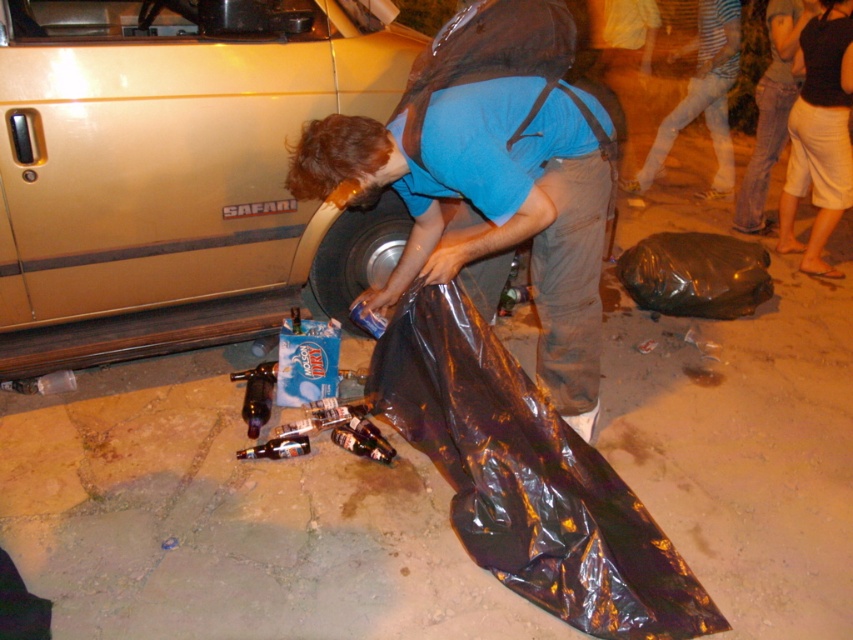
Question: Does shiny plastic bag at center appear on the right side of white cotton shorts at lower right?

Choices:
 (A) yes
 (B) no

Answer: (B)

Question: Estimate the real-world distances between objects in this image. Which object is farther from the striped cotton shirt at lower right?

Choices:
 (A) metallic silver tire at lower center
 (B) shiny plastic bag at center
 (C) white cotton shorts at lower right
 (D) gold metallic car door at lower left

Answer: (B)

Question: Considering the real-world distances, which object is farthest from the black plastic bag at lower right?

Choices:
 (A) gold metallic car door at lower left
 (B) white cotton shorts at lower right

Answer: (A)

Question: Among these points, which one is farthest from the camera?

Choices:
 (A) (392, 289)
 (B) (399, 228)
 (C) (717, 125)

Answer: (C)

Question: Does gold metallic car door at lower left have a lesser width compared to striped cotton shirt at lower right?

Choices:
 (A) no
 (B) yes

Answer: (A)

Question: Is the position of black plastic bag at lower right more distant than that of metallic silver tire at lower center?

Choices:
 (A) no
 (B) yes

Answer: (B)